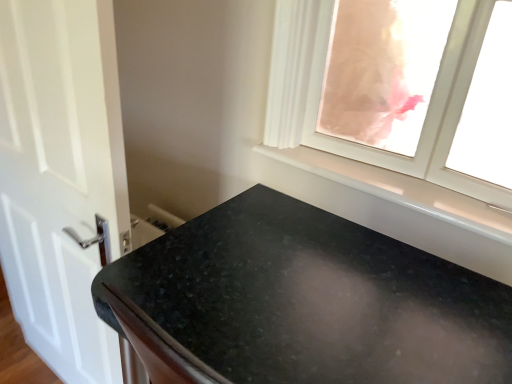
Question: Considering their positions, is white glossy window sill at upper right located in front of or behind black granite countertop at lower center?

Choices:
 (A) behind
 (B) front

Answer: (A)

Question: Which is correct: white glossy window sill at upper right is inside black granite countertop at lower center, or outside of it?

Choices:
 (A) inside
 (B) outside

Answer: (B)

Question: Estimate the real-world distances between objects in this image. Which object is farther from the white glossy door at left?

Choices:
 (A) white glossy window sill at upper right
 (B) transparent glass window at upper right
 (C) black granite countertop at lower center

Answer: (B)

Question: Which object is positioned farthest from the white glossy door at left?

Choices:
 (A) black granite countertop at lower center
 (B) white glossy window sill at upper right
 (C) transparent glass window at upper right

Answer: (C)